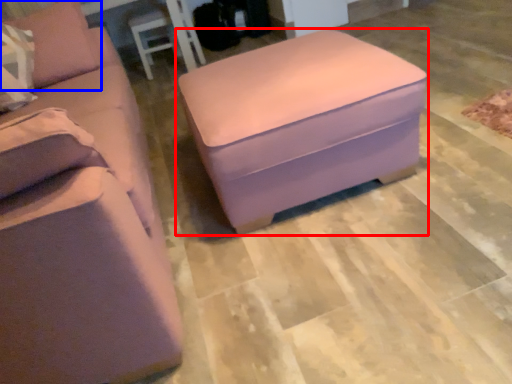
Question: Among these objects, which one is nearest to the camera, table (highlighted by a red box) or pillow (highlighted by a blue box)?

Choices:
 (A) table
 (B) pillow

Answer: (A)